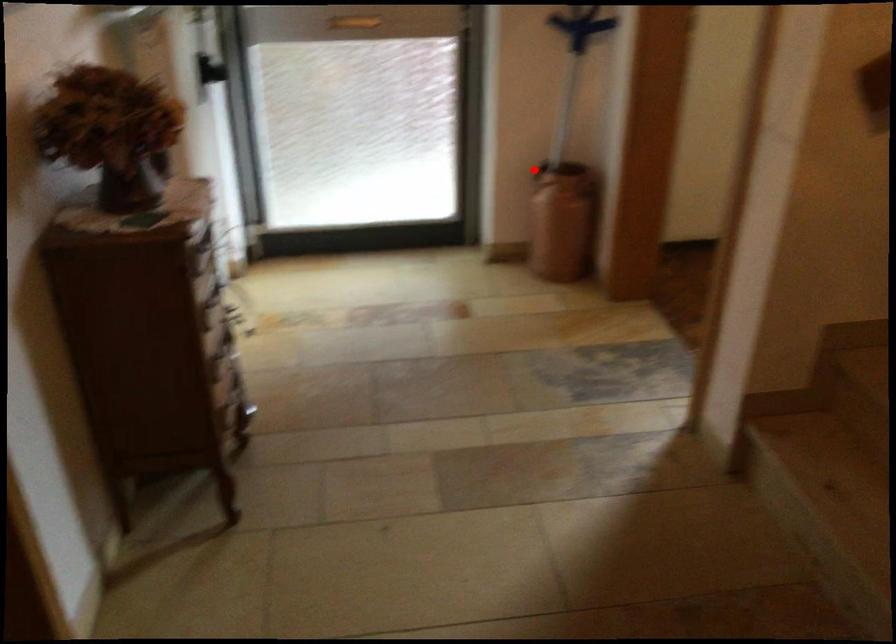
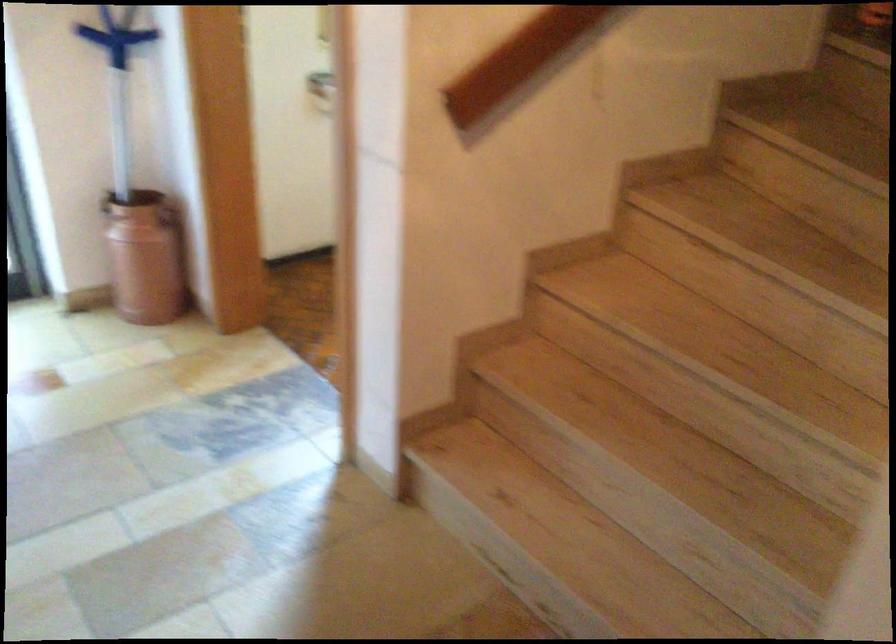
Locate, in the second image, the point that corresponds to the highlighted location in the first image.

(105, 202)